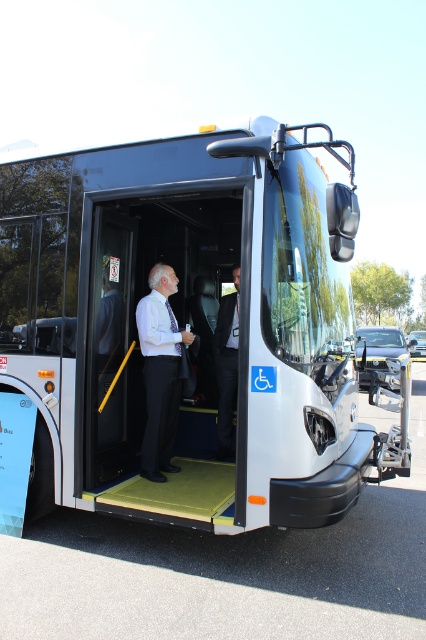
Question: Is white metallic bus at center further to camera compared to white glossy shirt at center?

Choices:
 (A) yes
 (B) no

Answer: (B)

Question: Considering the relative positions of white glossy shirt at center and dark gray suit at center in the image provided, where is white glossy shirt at center located with respect to dark gray suit at center?

Choices:
 (A) below
 (B) above

Answer: (A)

Question: Considering the real-world distances, which object is farthest from the white metallic bus at center?

Choices:
 (A) dark gray suit at center
 (B) white glossy shirt at center

Answer: (A)

Question: Which of the following is the closest to the observer?

Choices:
 (A) (236, 368)
 (B) (98, 317)

Answer: (B)

Question: Does white metallic bus at center have a smaller size compared to dark gray suit at center?

Choices:
 (A) no
 (B) yes

Answer: (A)

Question: Estimate the real-world distances between objects in this image. Which object is farther from the white metallic bus at center?

Choices:
 (A) dark gray suit at center
 (B) white glossy shirt at center

Answer: (A)